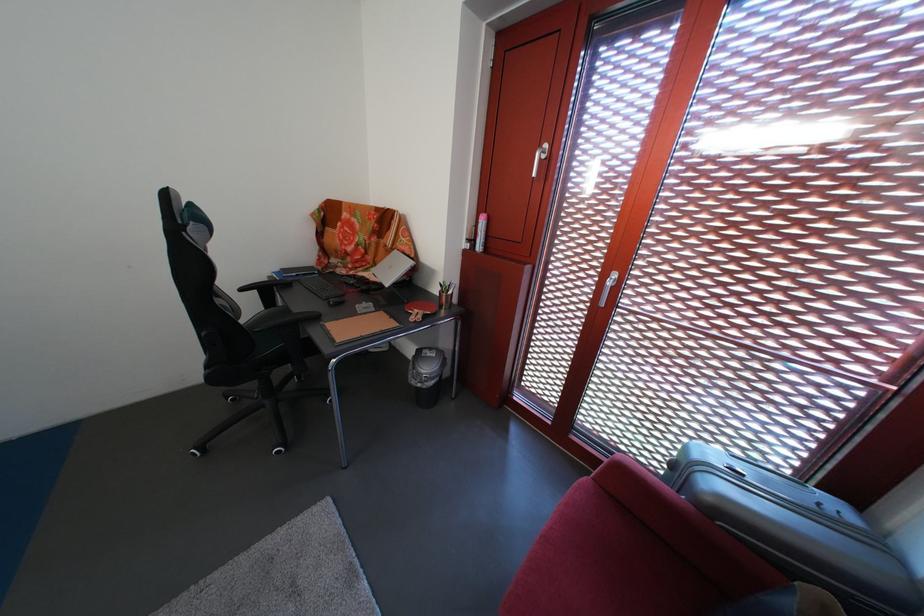
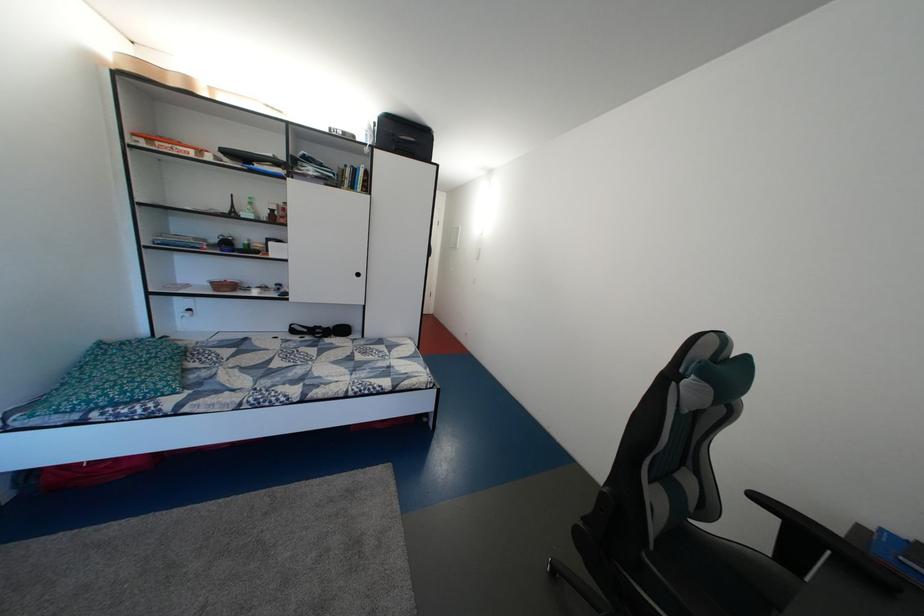
Where in the second image is the point corresponding to (x=253, y=296) from the first image?

(768, 504)